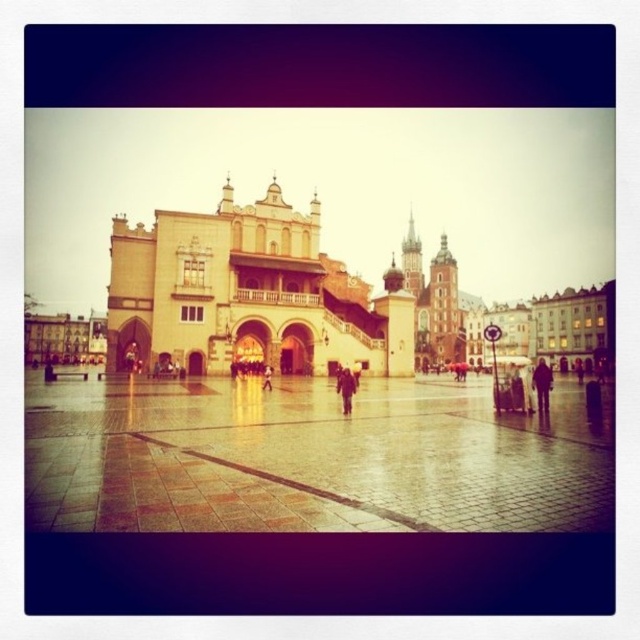
Image resolution: width=640 pixels, height=640 pixels. I want to click on light brown leather jacket at lower right, so click(541, 385).

Is light brown leather jacket at lower right below light brown leather jacket at center?

Correct, light brown leather jacket at lower right is located below light brown leather jacket at center.

What do you see at coordinates (541, 385) in the screenshot? I see `light brown leather jacket at lower right` at bounding box center [541, 385].

Identify the location of light brown leather jacket at lower right. This screenshot has height=640, width=640. (541, 385).